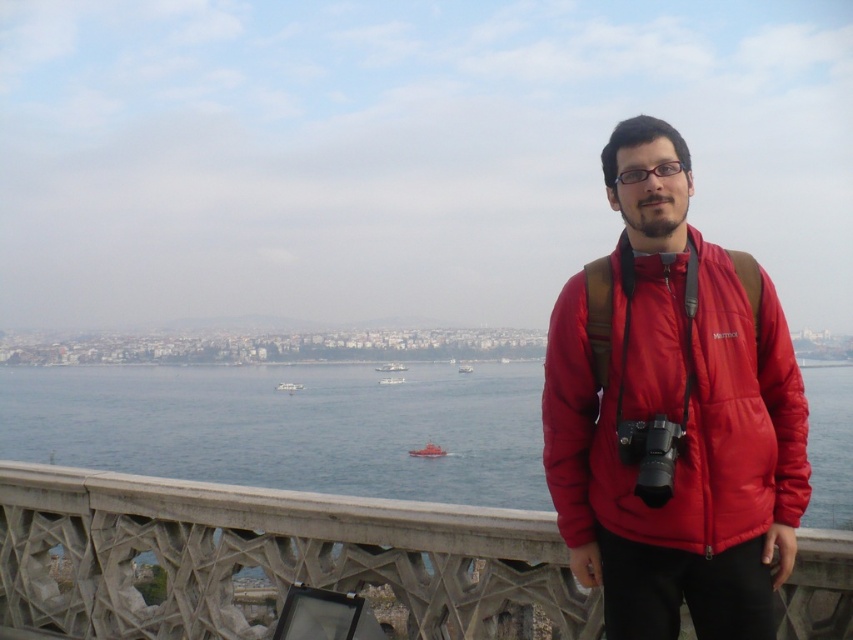
You are a photographer carrying a large camera. You notice the glossy plastic glasses at center and the smooth white boat at center in your viewfinder. Which object should you focus on if you want to capture the larger subject in your shot?

The smooth white boat at center is larger than the glossy plastic glasses at center, so you should focus on the smooth white boat at center to capture the larger subject.

You are a photographer standing in front of the stone railing. You notice two boats in the water. Which boat is closer to the camera, the smooth red boat at center or the white plastic boat at center?

The smooth red boat at center is positioned under the white plastic boat at center, so the white plastic boat at center is closer to the camera.

You are a photographer who wants to capture the smooth red boat at center and the white plastic boat at center in your shot. Which boat will have a wider appearance in your photo?

The smooth red boat at center has a greater width than the white plastic boat at center, so it will appear wider in the photo.